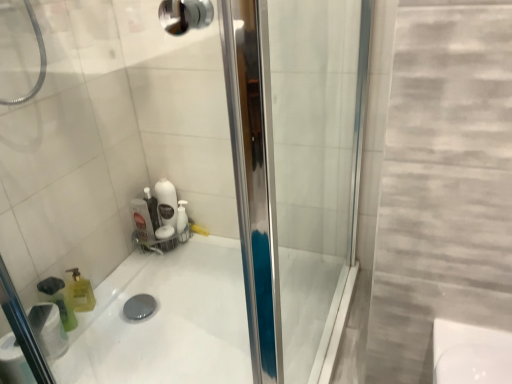
Question: Considering the relative positions of white glossy bath at center and white matte toilet paper at lower left in the image provided, is white glossy bath at center to the left or to the right of white matte toilet paper at lower left?

Choices:
 (A) right
 (B) left

Answer: (A)

Question: Is white glossy bath at center inside the boundaries of white matte toilet paper at lower left, or outside?

Choices:
 (A) outside
 (B) inside

Answer: (A)

Question: Which of these objects is positioned farthest from the white matte toilet paper at lower left?

Choices:
 (A) translucent green bottle at lower left
 (B) white glossy bath at center

Answer: (B)

Question: Considering the real-world distances, which object is closest to the white glossy bath at center?

Choices:
 (A) white matte toilet paper at lower left
 (B) translucent green bottle at lower left

Answer: (A)